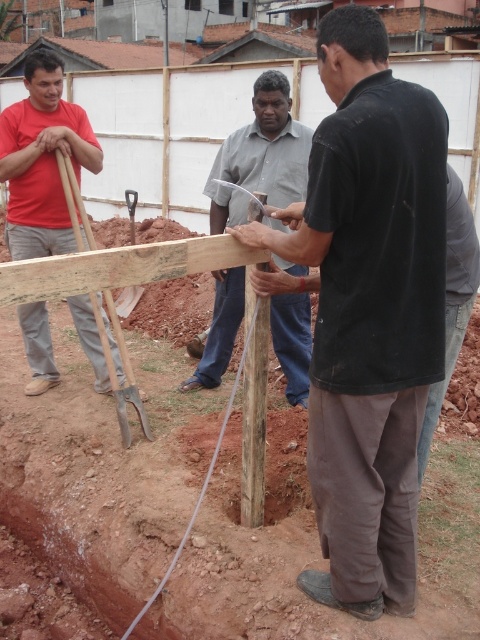
Question: Which is farther from the black matte shirt at center?

Choices:
 (A) matte red shirt at left
 (B) smooth gray shirt at center

Answer: (A)

Question: Estimate the real-world distances between objects in this image. Which object is closer to the black matte shirt at center?

Choices:
 (A) matte red shirt at left
 (B) smooth gray shirt at center

Answer: (B)

Question: Does matte red shirt at left appear over smooth gray shirt at center?

Choices:
 (A) yes
 (B) no

Answer: (A)

Question: Which point is closer to the camera taking this photo?

Choices:
 (A) (396, 172)
 (B) (288, 326)
 (C) (74, 310)

Answer: (A)

Question: Does black matte shirt at center appear on the right side of smooth gray shirt at center?

Choices:
 (A) yes
 (B) no

Answer: (A)

Question: Can you confirm if black matte shirt at center is thinner than matte red shirt at left?

Choices:
 (A) no
 (B) yes

Answer: (A)